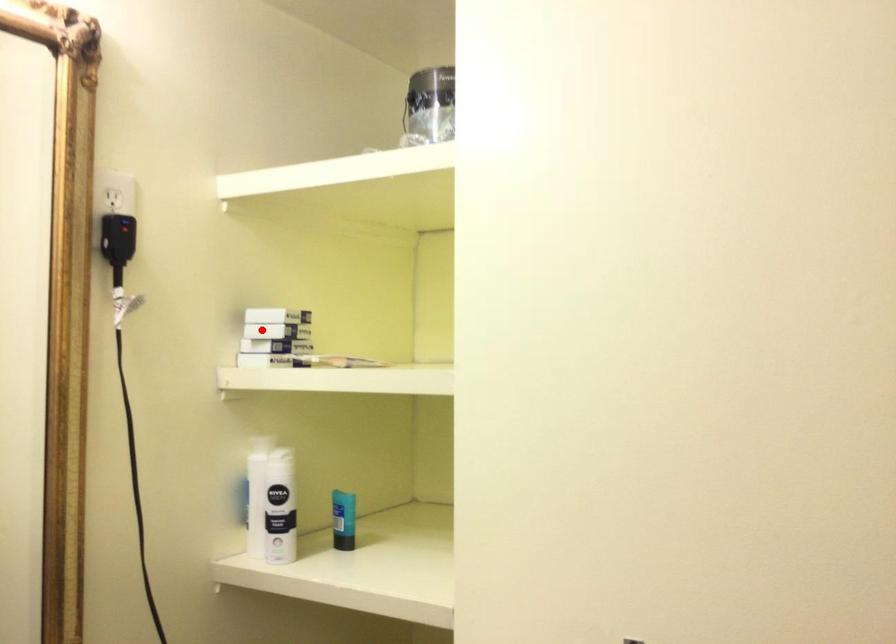
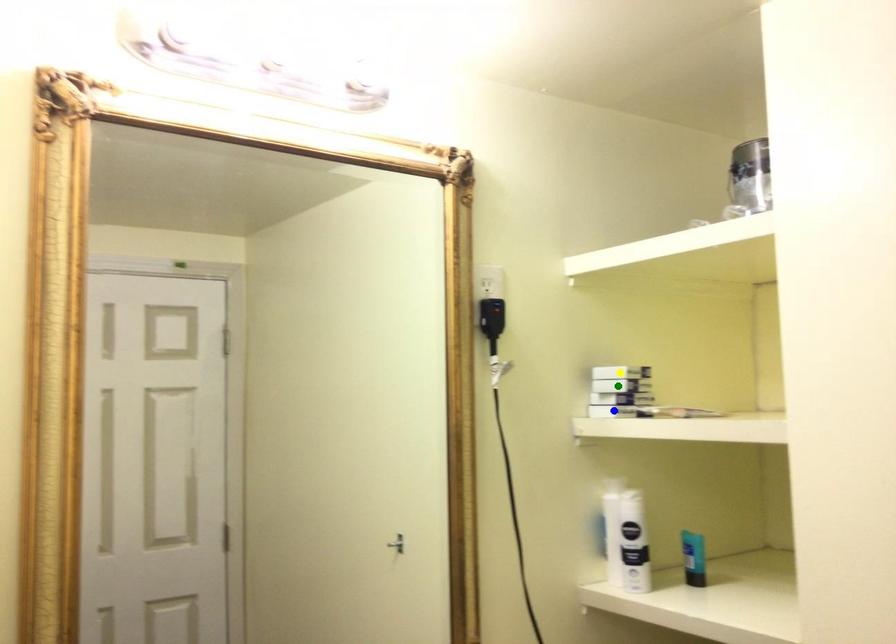
Question: I am providing you with two images of the same scene from different viewpoints. A red point is marked on the first image. You are given multiple points on the second image. Which mark in image 2 goes with the point in image 1?

Choices:
 (A) blue point
 (B) green point
 (C) yellow point

Answer: (B)